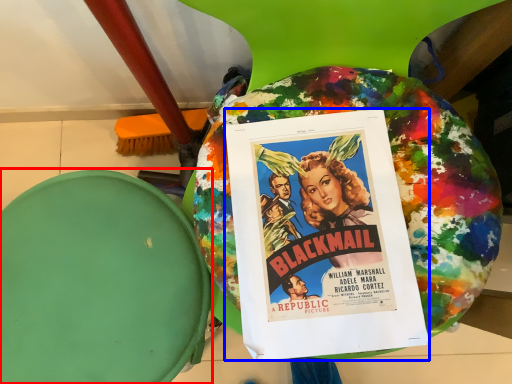
Question: Among these objects, which one is farthest to the camera, bean bag chair (highlighted by a red box) or poster (highlighted by a blue box)?

Choices:
 (A) bean bag chair
 (B) poster

Answer: (A)